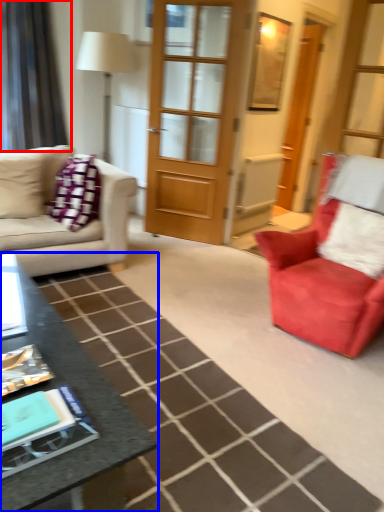
Question: Which object is closer to the camera taking this photo, curtain (highlighted by a red box) or table (highlighted by a blue box)?

Choices:
 (A) curtain
 (B) table

Answer: (B)